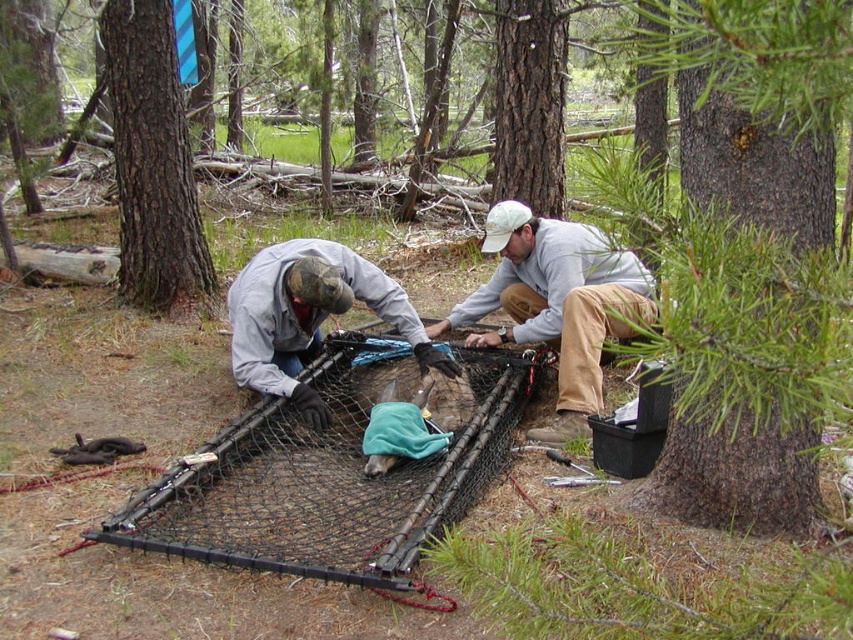
What is the 2D coordinate of the brown rough bark tree at upper left in the image?

The brown rough bark tree at upper left is located at the 2D coordinate point of (x=152, y=163).

You are a researcher in the forest and need to identify objects for a report. Which object is bigger between the brown rough bark tree at upper left and the camouflage fabric hat at center?

The brown rough bark tree at upper left is larger in size than the camouflage fabric hat at center.